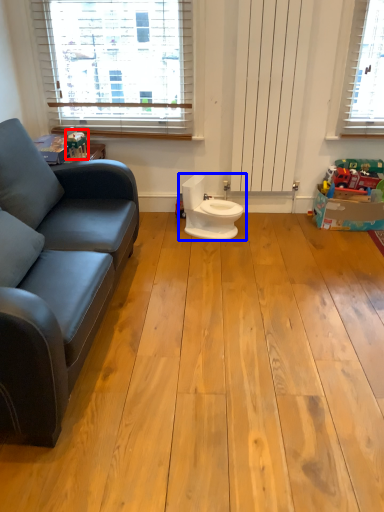
Question: Which object is closer to the camera taking this photo, toy (highlighted by a red box) or toilet (highlighted by a blue box)?

Choices:
 (A) toy
 (B) toilet

Answer: (A)